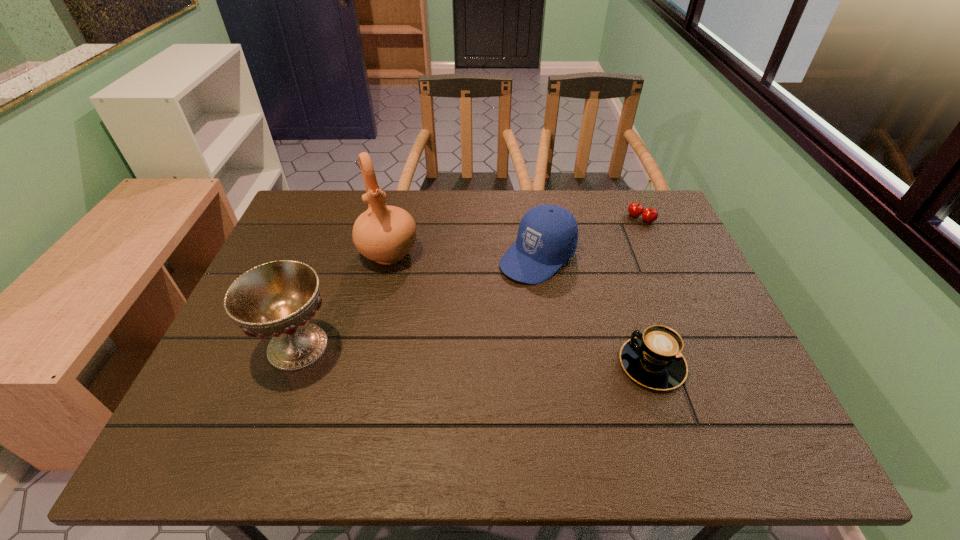
You are a GUI agent. You are given a task and a screenshot of the screen. Output one action in this format:
    pyautogui.click(x=<x>, y=<y>)
    Task: Click on the vacant space at the near edge of the desktop
    The width and height of the screenshot is (960, 540).
    Given the screenshot: What is the action you would take?
    pyautogui.click(x=403, y=401)

Locate an element on the screen. The height and width of the screenshot is (540, 960). vacant space at the left edge of the desktop is located at coordinates (314, 264).

I want to click on vacant position at the far left corner of the desktop, so click(313, 228).

Where is `vacant space at the far right corner of the desktop`? The height and width of the screenshot is (540, 960). vacant space at the far right corner of the desktop is located at coordinates (651, 234).

This screenshot has width=960, height=540. In order to click on free space between the tallest object and the cherry in this screenshot , I will do `click(515, 235)`.

At what (x,y) coordinates should I click in order to perform the action: click on free space between the fourth shortest object and the cherry. Please return your answer as a coordinate pair (x, y). The width and height of the screenshot is (960, 540). Looking at the image, I should click on (469, 282).

Where is `unoccupied position between the shortest object and the farthest object`? This screenshot has height=540, width=960. unoccupied position between the shortest object and the farthest object is located at coordinates (646, 291).

At what (x,y) coordinates should I click in order to perform the action: click on free space between the chalice and the tallest object. Please return your answer as a coordinate pair (x, y). Looking at the image, I should click on (343, 300).

Image resolution: width=960 pixels, height=540 pixels. Identify the location of vacant space in between the chalice and the tallest object. (343, 300).

The height and width of the screenshot is (540, 960). I want to click on blank region between the second object from right to left and the pottery, so click(520, 308).